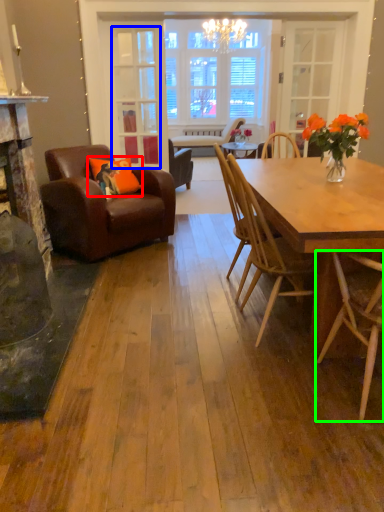
Question: Which object is positioned closest to pillow (highlighted by a red box)? Select from glass door (highlighted by a blue box) and chair (highlighted by a green box).

Choices:
 (A) glass door
 (B) chair

Answer: (A)